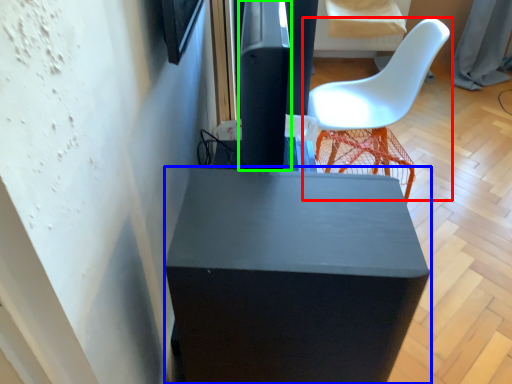
Question: Which object is positioned closest to chair (highlighted by a red box)? Select from furniture (highlighted by a blue box) and pillar (highlighted by a green box).

Choices:
 (A) furniture
 (B) pillar

Answer: (B)